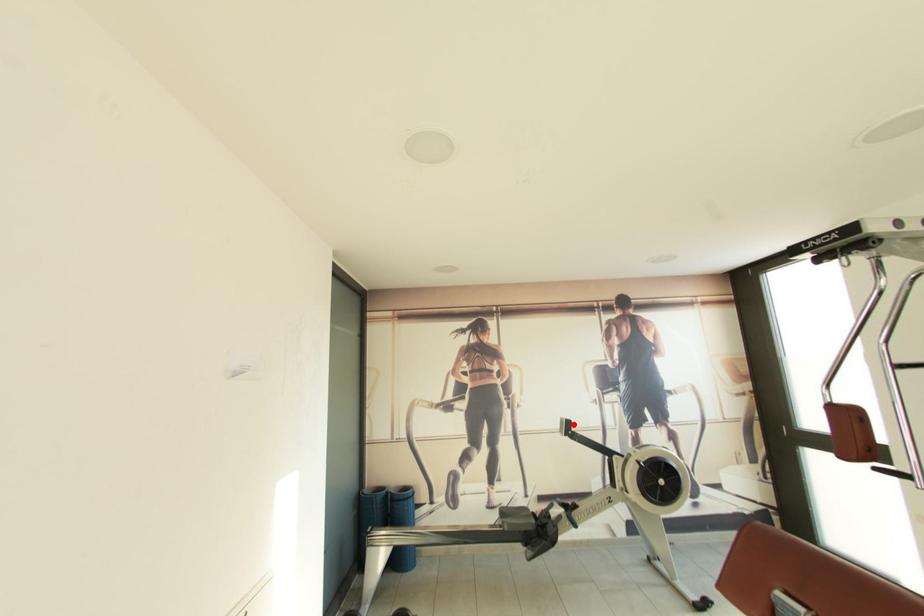
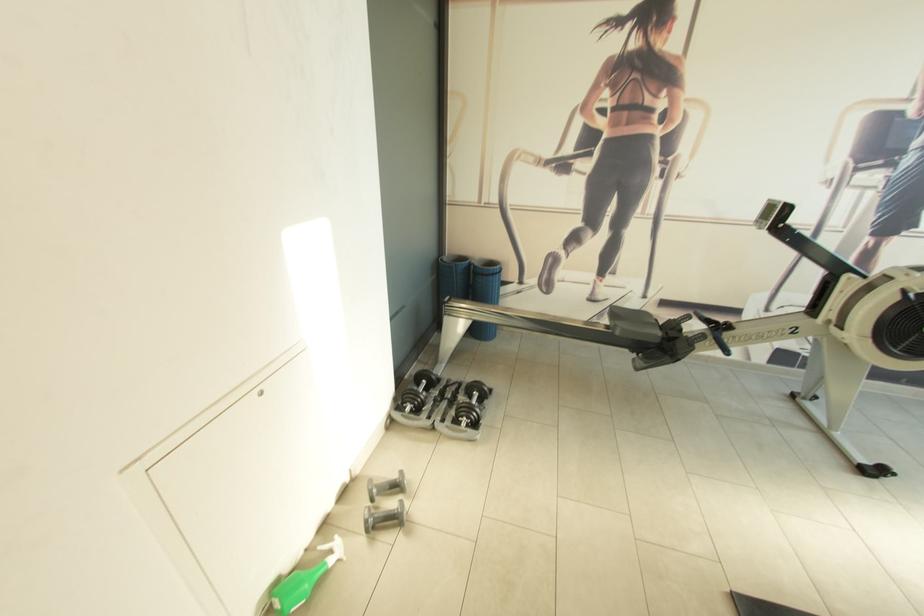
Locate, in the second image, the point that corresponds to the highlighted location in the first image.

(792, 209)